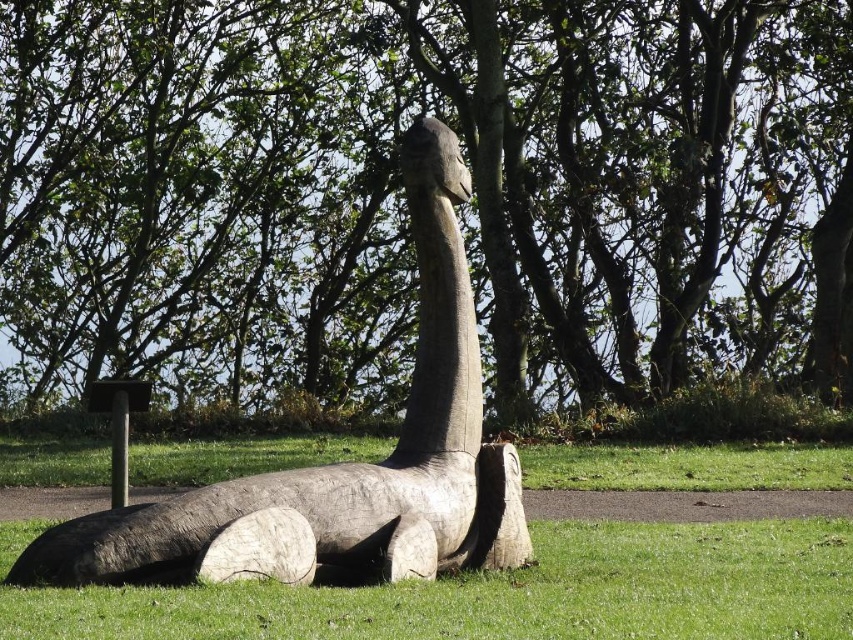
Does green matte wood at center appear over wooden statue at center?

No.

Is green matte wood at center shorter than wooden statue at center?

Yes.

Between point (807, 564) and point (415, 396), which one is positioned behind?

Positioned behind is point (415, 396).

The width and height of the screenshot is (853, 640). What are the coordinates of `green matte wood at center` in the screenshot? It's located at (498, 592).

Between green wood tree at center and green matte wood at center, which one has more height?

green wood tree at center

Is point (393, 387) behind point (566, 620)?

That is True.

Locate an element on the screen. The image size is (853, 640). green wood tree at center is located at coordinates (402, 193).

Between green wood tree at center and wooden statue at center, which one has less height?

Standing shorter between the two is wooden statue at center.

Which is behind, point (262, 154) or point (442, 380)?

The point (262, 154) is more distant.

Identify the location of green wood tree at center. This screenshot has height=640, width=853. (402, 193).